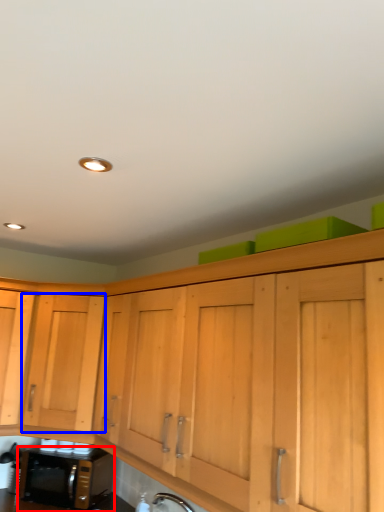
Question: Which of the following is the farthest to the observer, microwave oven (highlighted by a red box) or cabinetry (highlighted by a blue box)?

Choices:
 (A) microwave oven
 (B) cabinetry

Answer: (A)